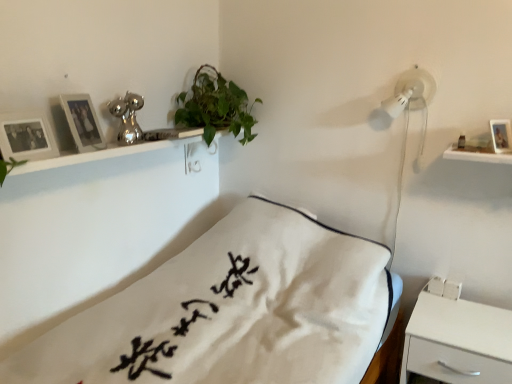
Question: Considering the relative sizes of green leafy plant at upper center and white matte nightstand at lower right in the image provided, is green leafy plant at upper center shorter than white matte nightstand at lower right?

Choices:
 (A) yes
 (B) no

Answer: (A)

Question: Is green leafy plant at upper center bigger than white matte nightstand at lower right?

Choices:
 (A) no
 (B) yes

Answer: (A)

Question: From a real-world perspective, is green leafy plant at upper center positioned over white matte nightstand at lower right based on gravity?

Choices:
 (A) yes
 (B) no

Answer: (A)

Question: Does green leafy plant at upper center come in front of white matte nightstand at lower right?

Choices:
 (A) yes
 (B) no

Answer: (B)

Question: Considering the relative sizes of green leafy plant at upper center and white matte nightstand at lower right in the image provided, is green leafy plant at upper center smaller than white matte nightstand at lower right?

Choices:
 (A) no
 (B) yes

Answer: (B)

Question: Is green leafy plant at upper center not close to white matte nightstand at lower right?

Choices:
 (A) no
 (B) yes

Answer: (B)

Question: Can white matte nightstand at lower right be found inside wooden photo frame at upper left, the 3th picture frame from the right?

Choices:
 (A) no
 (B) yes

Answer: (A)

Question: Is wooden photo frame at upper left, the first picture frame in the left-to-right sequence, positioned beyond the bounds of white matte nightstand at lower right?

Choices:
 (A) no
 (B) yes

Answer: (B)

Question: Does wooden photo frame at upper left, the first picture frame in the left-to-right sequence, have a greater height compared to white matte nightstand at lower right?

Choices:
 (A) yes
 (B) no

Answer: (B)

Question: From a real-world perspective, is wooden photo frame at upper left, the first picture frame in the left-to-right sequence, located beneath white matte nightstand at lower right?

Choices:
 (A) yes
 (B) no

Answer: (B)

Question: Is wooden photo frame at upper left, the 3th picture frame from the right, turned away from white matte nightstand at lower right?

Choices:
 (A) no
 (B) yes

Answer: (A)

Question: Considering the relative sizes of wooden photo frame at upper left, the 3th picture frame from the right, and white matte nightstand at lower right in the image provided, is wooden photo frame at upper left, the 3th picture frame from the right, smaller than white matte nightstand at lower right?

Choices:
 (A) no
 (B) yes

Answer: (B)

Question: Is wooden photo frame at upper left, the 3th picture frame from the right, further to the viewer compared to green leafy plant at upper center?

Choices:
 (A) no
 (B) yes

Answer: (A)